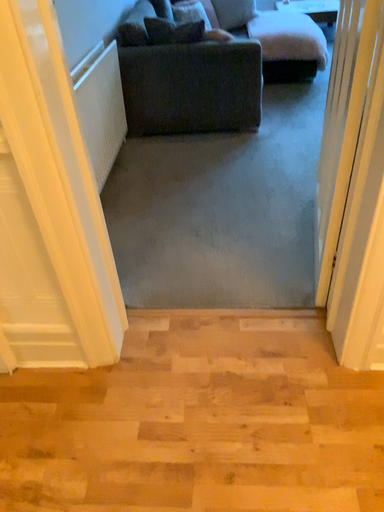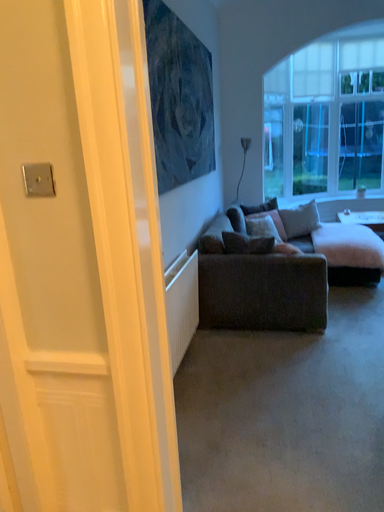
Question: How did the camera likely rotate when shooting the video?

Choices:
 (A) rotated downward
 (B) rotated upward

Answer: (B)